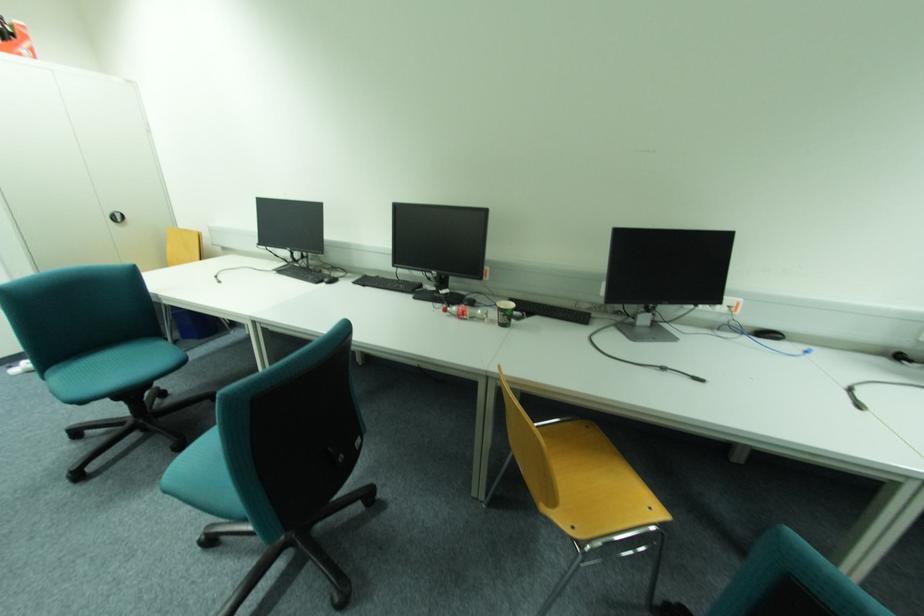
The height and width of the screenshot is (616, 924). What are the coordinates of `yellow chair sitting surface` in the screenshot? It's located at (600, 474).